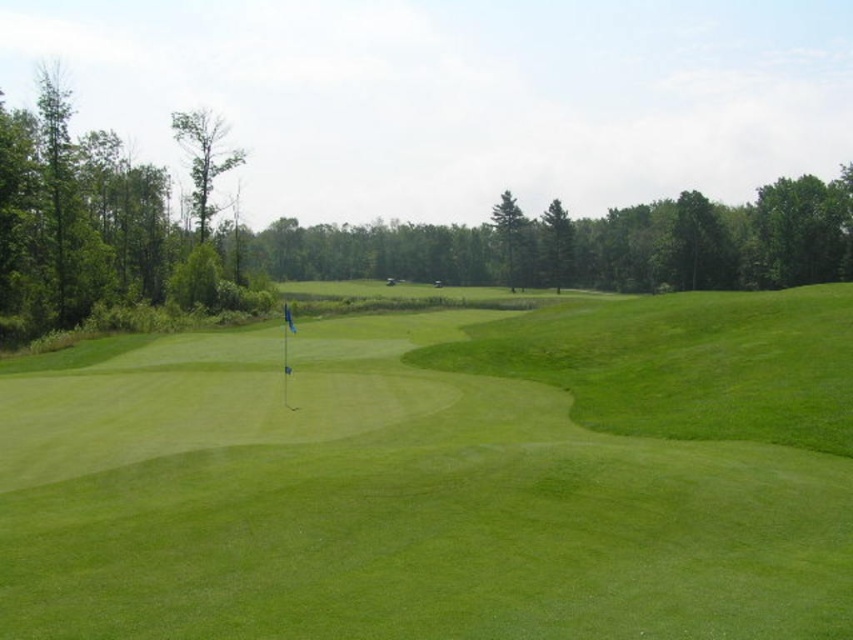
Can you confirm if green grassy golf course at center is smaller than smooth brown tree at upper left?

Correct, green grassy golf course at center occupies less space than smooth brown tree at upper left.

Is green grassy golf course at center thinner than smooth brown tree at upper left?

Yes.

Is point (538, 545) less distant than point (210, 115)?

Yes, it is in front of point (210, 115).

Where is `green grassy golf course at center`? Image resolution: width=853 pixels, height=640 pixels. green grassy golf course at center is located at coordinates (440, 476).

Consider the image. Does green textured tree at center appear on the right side of green leafy tree at center?

In fact, green textured tree at center is to the left of green leafy tree at center.

Between green textured tree at center and green leafy tree at center, which one is positioned higher?

green textured tree at center is above.

Does point (514, 241) come closer to viewer compared to point (561, 275)?

Yes, point (514, 241) is in front of point (561, 275).

What are the coordinates of `green textured tree at center` in the screenshot? It's located at (511, 237).

From the picture: Is green grassy golf course at center to the left of green leafy tree at left from the viewer's perspective?

In fact, green grassy golf course at center is to the right of green leafy tree at left.

Between point (645, 426) and point (181, 252), which one is positioned behind?

The point (181, 252) is more distant.

Who is more distant from viewer, (410, 528) or (3, 225)?

Positioned behind is point (3, 225).

At what (x,y) coordinates should I click in order to perform the action: click on green grassy golf course at center. Please return your answer as a coordinate pair (x, y). Looking at the image, I should click on (440, 476).